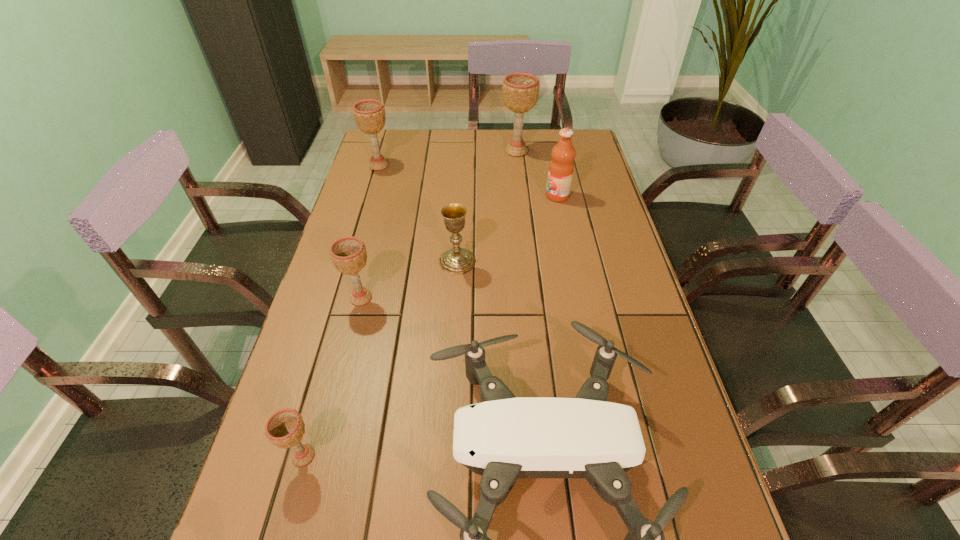
You are a GUI agent. You are given a task and a screenshot of the screen. Output one action in this format:
    pyautogui.click(x=<x>, y=<y>)
    Task: Click on the tallest chalice
    
    Given the screenshot: What is the action you would take?
    pyautogui.click(x=520, y=90)

I want to click on the biggest beige chalice, so click(520, 90).

You are a GUI agent. You are given a task and a screenshot of the screen. Output one action in this format:
    pyautogui.click(x=<x>, y=<y>)
    Task: Click on the fifth nearest object
    The height and width of the screenshot is (540, 960).
    Given the screenshot: What is the action you would take?
    pyautogui.click(x=561, y=167)

The height and width of the screenshot is (540, 960). What are the coordinates of `the third smallest beige chalice` in the screenshot? It's located at (369, 115).

Find the location of a particular element. This screenshot has height=540, width=960. the fourth farthest object is located at coordinates (457, 260).

Locate an element on the screen. The width and height of the screenshot is (960, 540). gold chalice is located at coordinates (457, 260).

Locate an element on the screen. The height and width of the screenshot is (540, 960). the second smallest beige chalice is located at coordinates (348, 254).

You are a GUI agent. You are given a task and a screenshot of the screen. Output one action in this format:
    pyautogui.click(x=<x>, y=<y>)
    Task: Click on the fourth farthest chalice
    
    Given the screenshot: What is the action you would take?
    pyautogui.click(x=348, y=254)

Locate an element on the screen. The height and width of the screenshot is (540, 960). the nearest chalice is located at coordinates (285, 428).

I want to click on the shortest chalice, so click(285, 428).